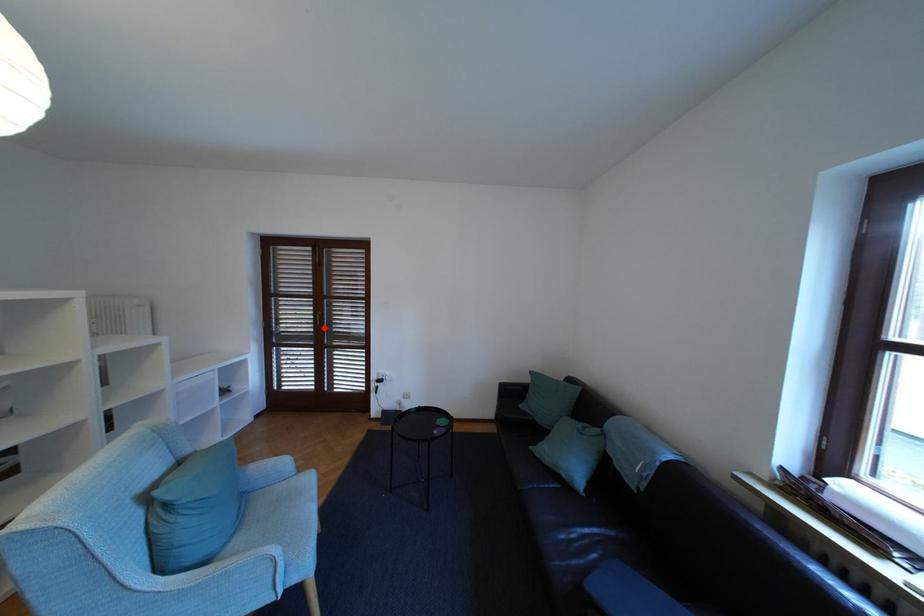
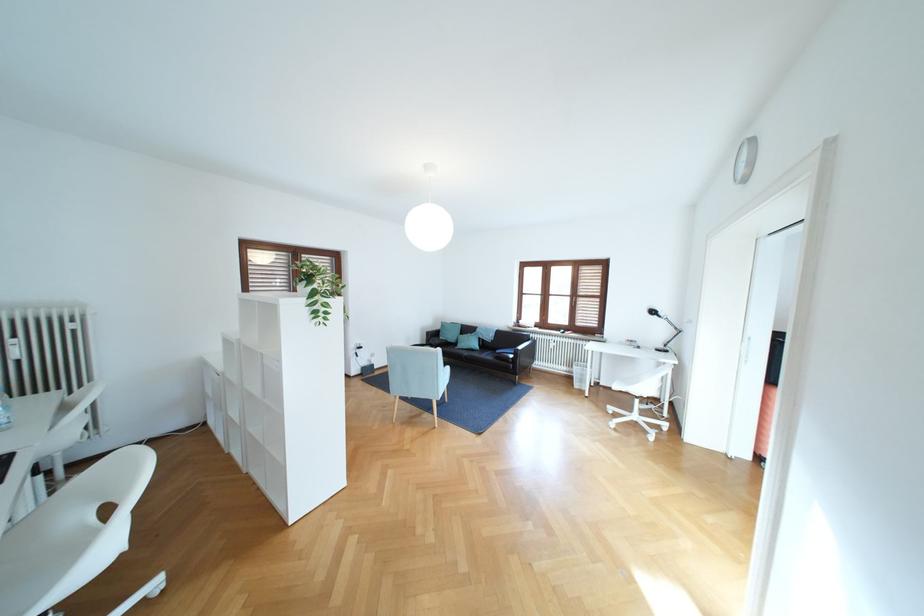
Question: I am providing you with two images of the same scene from different viewpoints. A red point is marked on the first image. At the location where the point appears in image 1, is it still visible in image 2?

Choices:
 (A) Yes
 (B) No

Answer: (B)